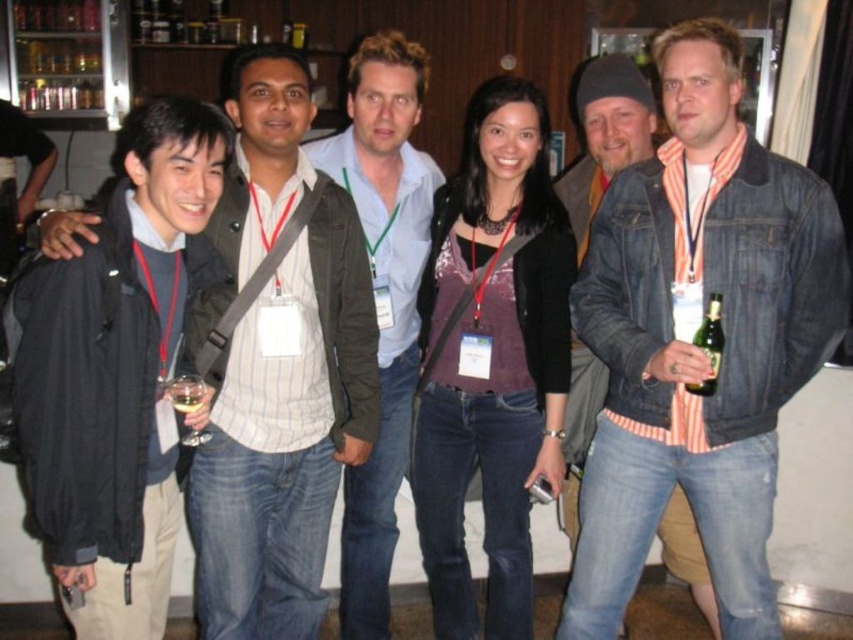
This screenshot has width=853, height=640. What do you see at coordinates (709, 342) in the screenshot?
I see `green glass bottle at right` at bounding box center [709, 342].

Can you confirm if green glass bottle at right is thinner than clear glass wine glass at left?

No.

Is point (685, 384) behind point (171, 388)?

Yes.

This screenshot has height=640, width=853. In order to click on green glass bottle at right in this screenshot , I will do `click(709, 342)`.

Can you confirm if denim jacket at right is positioned below matte black jacket at left?

No.

Does denim jacket at right appear on the left side of matte black jacket at left?

No, denim jacket at right is not to the left of matte black jacket at left.

Does point (666, 186) come in front of point (245, 403)?

No.

The height and width of the screenshot is (640, 853). What are the coordinates of `denim jacket at right` in the screenshot? It's located at (695, 346).

In the scene shown: Is black matte jacket at left wider than clear glass wine glass at left?

Correct, the width of black matte jacket at left exceeds that of clear glass wine glass at left.

Which is more to the left, black matte jacket at left or clear glass wine glass at left?

Positioned to the left is black matte jacket at left.

What do you see at coordinates (117, 371) in the screenshot? I see `black matte jacket at left` at bounding box center [117, 371].

Image resolution: width=853 pixels, height=640 pixels. I want to click on black matte jacket at left, so [117, 371].